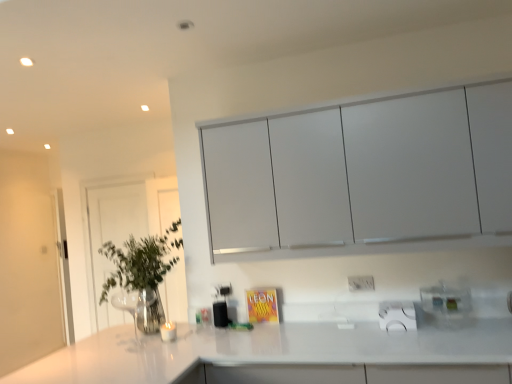
Question: Is white plastic electric outlet at center facing towards white matte cabinet at upper center?

Choices:
 (A) yes
 (B) no

Answer: (B)

Question: Is white plastic electric outlet at center further to the viewer compared to white matte cabinet at upper center?

Choices:
 (A) yes
 (B) no

Answer: (A)

Question: Can you confirm if white plastic electric outlet at center is shorter than white matte cabinet at upper center?

Choices:
 (A) no
 (B) yes

Answer: (B)

Question: Considering the relative sizes of white plastic electric outlet at center and white matte cabinet at upper center in the image provided, is white plastic electric outlet at center taller than white matte cabinet at upper center?

Choices:
 (A) no
 (B) yes

Answer: (A)

Question: Would you say white plastic electric outlet at center is outside white matte cabinet at upper center?

Choices:
 (A) no
 (B) yes

Answer: (B)

Question: Is clear glass vase at left taller or shorter than clear glass door at left?

Choices:
 (A) tall
 (B) short

Answer: (B)

Question: Is clear glass vase at left to the left or to the right of clear glass door at left in the image?

Choices:
 (A) left
 (B) right

Answer: (B)

Question: Is point (126, 276) positioned closer to the camera than point (126, 196)?

Choices:
 (A) closer
 (B) farther

Answer: (A)

Question: Is clear glass vase at left bigger or smaller than clear glass door at left?

Choices:
 (A) small
 (B) big

Answer: (B)

Question: Which is correct: clear glass vase at left is inside clear plastic spice rack at lower right, or outside of it?

Choices:
 (A) outside
 (B) inside

Answer: (A)

Question: Does point (121, 266) appear closer or farther from the camera than point (467, 301)?

Choices:
 (A) closer
 (B) farther

Answer: (B)

Question: From the image's perspective, is clear glass vase at left positioned above or below clear plastic spice rack at lower right?

Choices:
 (A) above
 (B) below

Answer: (A)

Question: Looking at their shapes, would you say clear glass vase at left is wider or thinner than clear plastic spice rack at lower right?

Choices:
 (A) wide
 (B) thin

Answer: (A)

Question: Considering their positions, is clear glass door at left located in front of or behind clear glass vase at left?

Choices:
 (A) behind
 (B) front

Answer: (A)

Question: Choose the correct answer: Is clear glass door at left inside clear glass vase at left or outside it?

Choices:
 (A) inside
 (B) outside

Answer: (B)